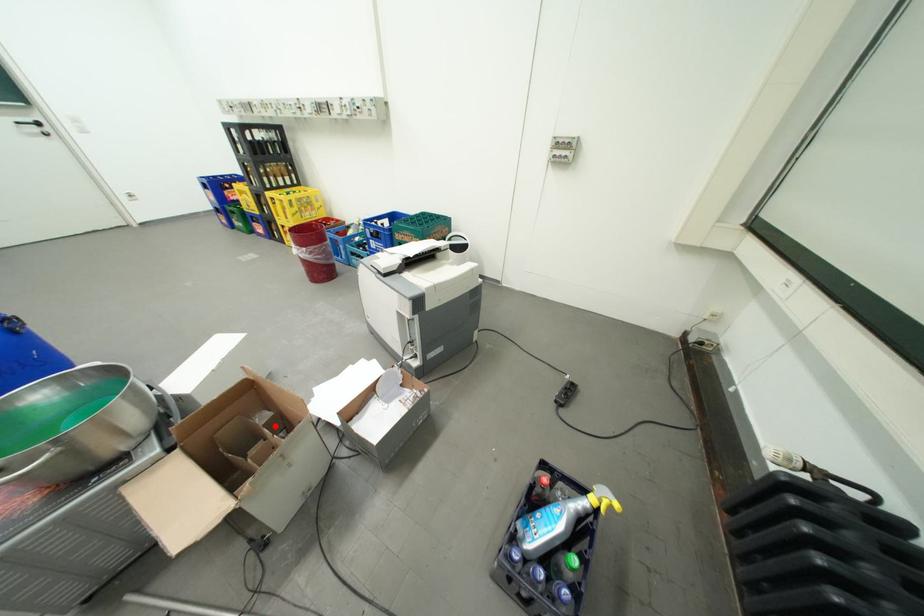
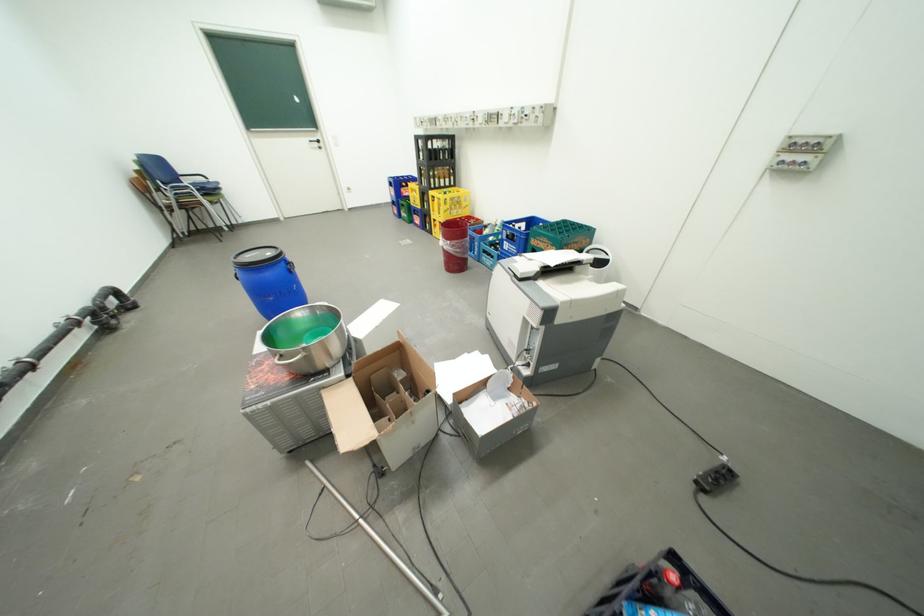
Where in the second image is the point corresponding to the highlighted location from the first image?

(410, 382)